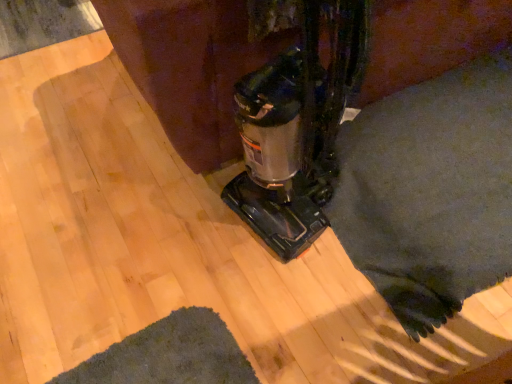
Where is `vacant region to the left of metallic black vacuum cleaner at center`? vacant region to the left of metallic black vacuum cleaner at center is located at coordinates (183, 224).